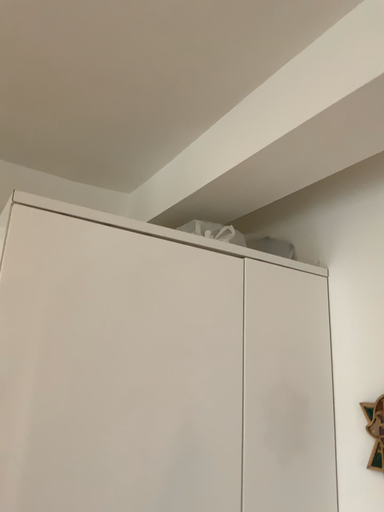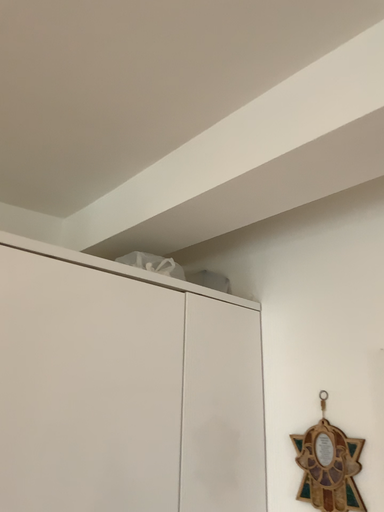
Question: How did the camera likely rotate when shooting the video?

Choices:
 (A) rotated right
 (B) rotated left

Answer: (A)